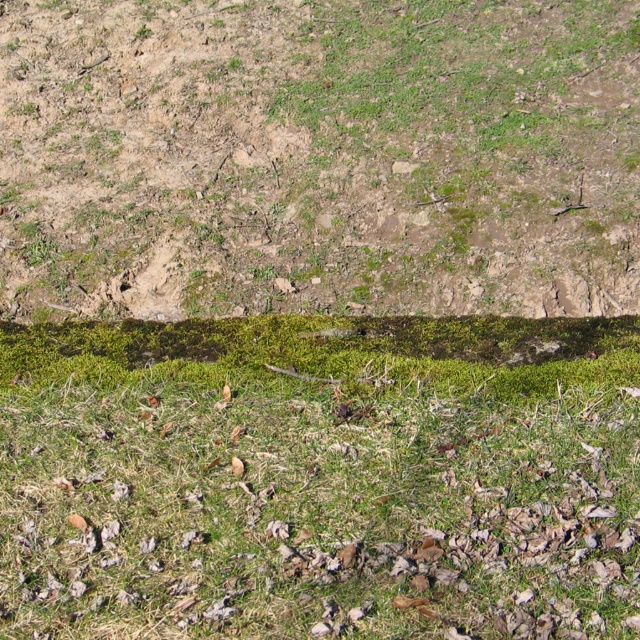
Is green grassy at lower center thinner than green mossy soil at center?

Yes, green grassy at lower center is thinner than green mossy soil at center.

Is green grassy at lower center further to the viewer compared to green mossy soil at center?

No, green grassy at lower center is closer to the viewer.

Does point (502, 449) lie in front of point (488, 8)?

Yes, point (502, 449) is in front of point (488, 8).

I want to click on green grassy at lower center, so click(321, 477).